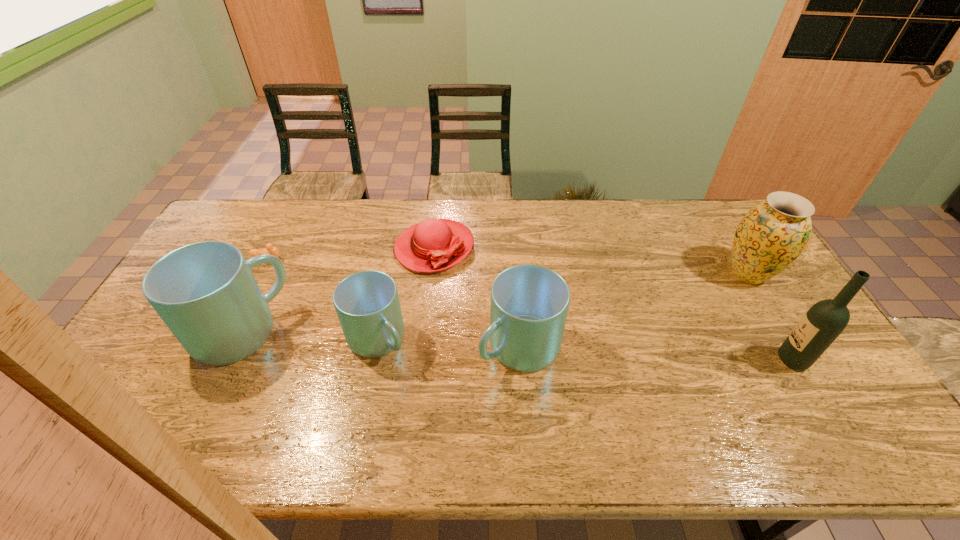
I want to click on vacant point located between the vase and the third object from right to left, so click(x=634, y=310).

Image resolution: width=960 pixels, height=540 pixels. I want to click on vacant space in between the wine bottle and the hat, so click(613, 304).

Locate an element on the screen. blank region between the shortest object and the vase is located at coordinates (508, 267).

What are the coordinates of `object that stands as the fifth closest to the wine bottle` in the screenshot? It's located at (206, 294).

I want to click on object that stands as the fourth closest to the leftmost mug, so click(x=529, y=305).

The image size is (960, 540). What are the coordinates of `mug that stands as the third closest to the vase` in the screenshot? It's located at (206, 294).

Where is `the third closest mug to the shortest object`? The width and height of the screenshot is (960, 540). the third closest mug to the shortest object is located at coordinates (529, 305).

Identify the location of blank space that satisfies the following two spatial constraints: 1. on the face of the duckling; 2. on the left side of the fifth object from left to right. (224, 347).

The width and height of the screenshot is (960, 540). Find the location of `vacant space that satisfies the following two spatial constraints: 1. at the front of the hat with a bow; 2. on the left side of the vase`. vacant space that satisfies the following two spatial constraints: 1. at the front of the hat with a bow; 2. on the left side of the vase is located at coordinates (431, 274).

The image size is (960, 540). I want to click on free space that satisfies the following two spatial constraints: 1. on the face of the duckling; 2. on the left side of the vase, so (261, 274).